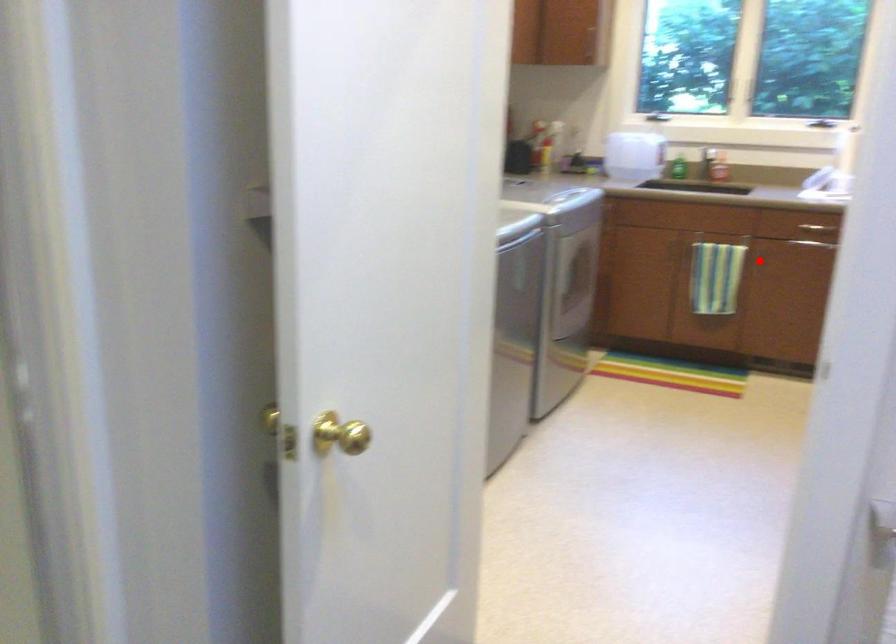
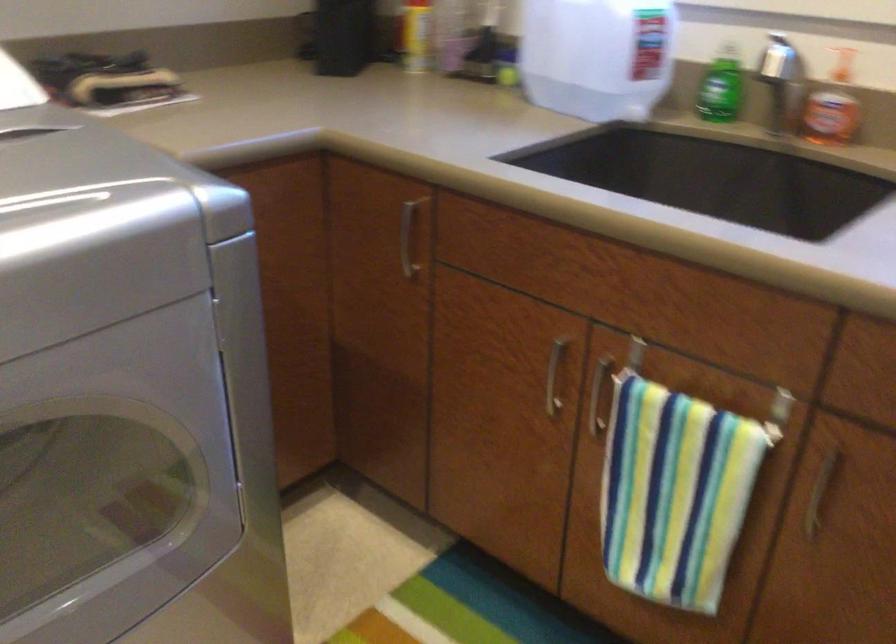
Question: I am providing you with two images of the same scene from different viewpoints. Given a red point in image1, look at the same physical point in image2. Is it:

Choices:
 (A) Closer to the viewpoint
 (B) Farther from the viewpoint

Answer: (A)